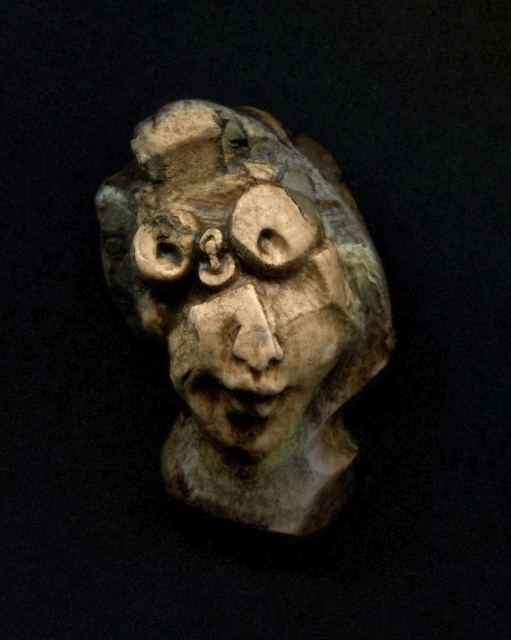
You are an art conservator examining the sculpture. You notice that the matte stone sculpture at center and the carved stone face at center are positioned in a way that might affect their structural stability. Which sculpture is positioned to the right, potentially making it more vulnerable to uneven weight distribution?

The matte stone sculpture at center is positioned to the right of the carved stone face at center, which could make it more vulnerable to uneven weight distribution.

You are an art conservator working with a precision tool that can only reach objects within a 2 inch radius. You need to clean both the matte stone sculpture at center and the carved stone face at center. Can your tool reach both without moving the sculpture?

The matte stone sculpture at center and the carved stone face at center are 1.97 inches apart from each other. Since the tool can reach within a 2 inch radius, it can clean both without needing to move the sculpture.

In the scene shown: You are an art conservator examining the sculpture. You notice a specific point at coordinates (247,307) on the sculpture. What material characteristic is associated with this point?

The point at coordinates (247,307) marks the matte stone sculpture at center, indicating a nonreflective surface texture.